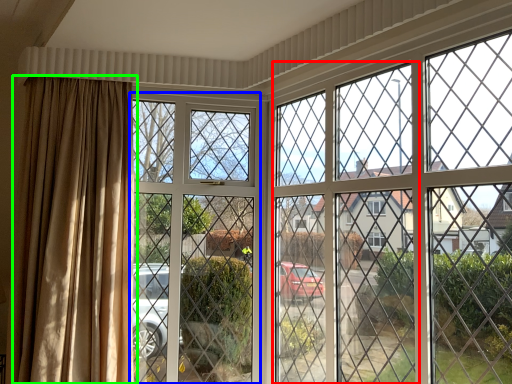
Question: Which is nearer to the screen door (highlighted by a red box)? screen door (highlighted by a blue box) or curtain (highlighted by a green box).

Choices:
 (A) screen door
 (B) curtain

Answer: (A)